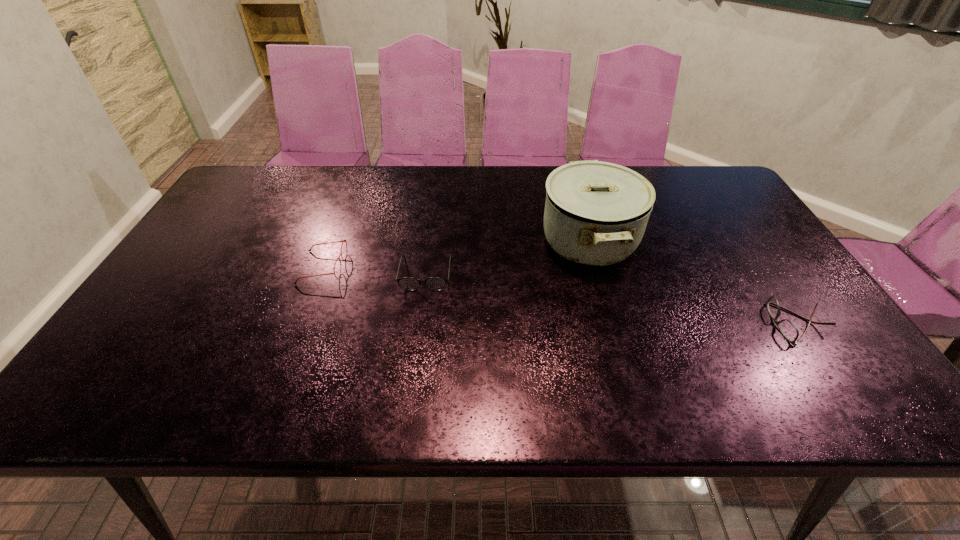
The image size is (960, 540). In order to click on object identified as the third closest to the leftmost object in this screenshot , I will do `click(787, 328)`.

Find the location of a particular element. Image resolution: width=960 pixels, height=540 pixels. object that ranks as the third closest to the second object from right to left is located at coordinates (344, 240).

Where is `spectacles that is the third closest one to the saucepan`? This screenshot has width=960, height=540. spectacles that is the third closest one to the saucepan is located at coordinates (344, 240).

You are a GUI agent. You are given a task and a screenshot of the screen. Output one action in this format:
    pyautogui.click(x=<x>, y=<y>)
    Task: Click on the second closest spectacles to the second object from left to right
    
    Given the screenshot: What is the action you would take?
    click(x=787, y=328)

Locate an element on the screen. The image size is (960, 540). free spot that satisfies the following two spatial constraints: 1. on the front side of the third object from left to right; 2. on the face of the leftmost object is located at coordinates (596, 267).